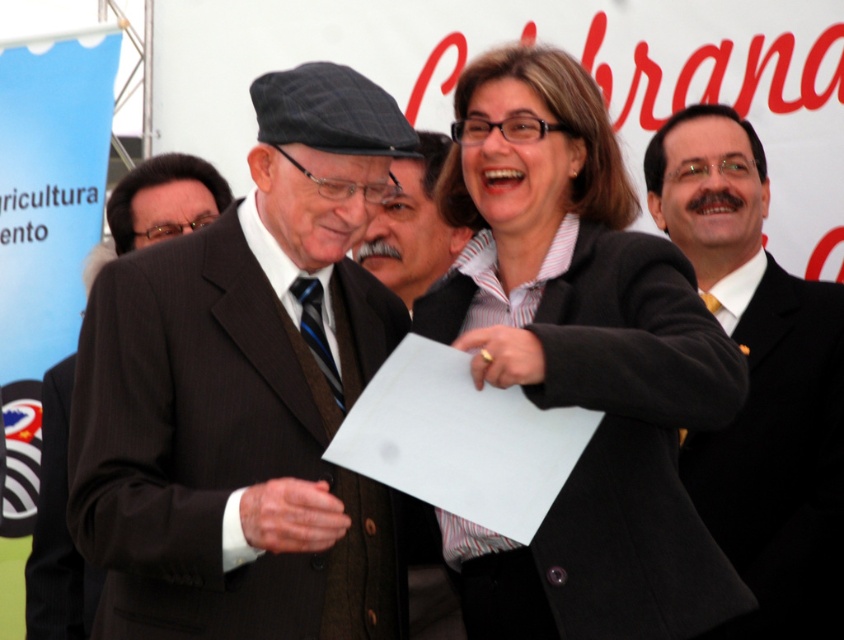
You are an event photographer at the ceremony. You need to capture a photo where both the dark brown wool suit at lower left and the gray woolen hat at center are clearly visible. Given their height difference, which object will appear larger in the photo?

The dark brown wool suit at lower left is much taller than the gray woolen hat at center, so it will appear larger in the photo.

You are a photographer at a formal event. You need to capture a photo of the dark brown pinstripe suit at center and the dark brown wool suit at lower left. The camera you are using has a maximum focus range of 12 inches. Can you take a photo of both suits in focus without moving the camera?

The dark brown pinstripe suit at center is 11.71 inches away from the dark brown wool suit at lower left. Since the distance between them is within the camera maximum focus range of 12 inches, you can take a photo of both suits in focus without moving the camera.

In the scene shown: Based on the scene description, which object is located below the other between the dark brown wool suit at lower left and the gray woolen hat at center?

The dark brown wool suit at lower left is positioned under the gray woolen hat at center.